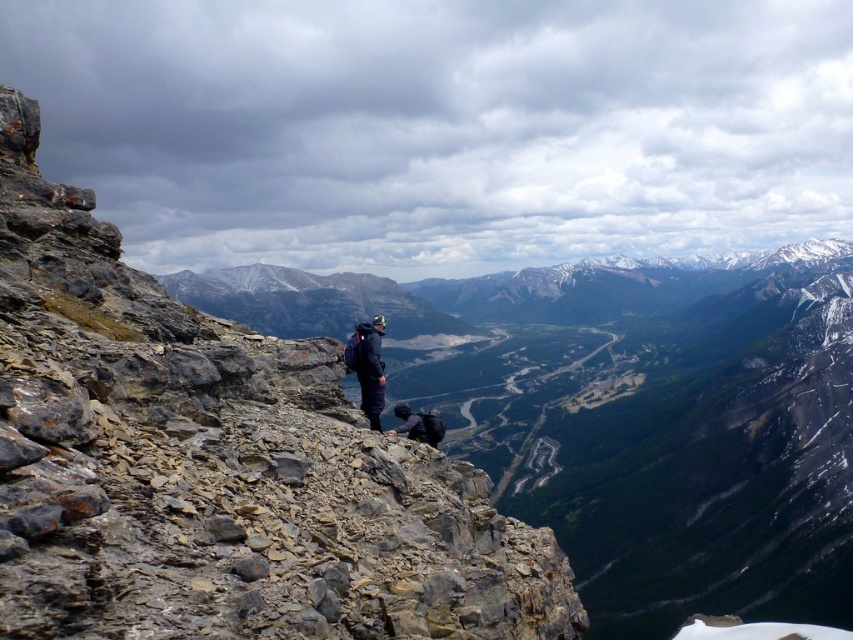
Question: Which point appears farthest from the camera in this image?

Choices:
 (A) (354, 369)
 (B) (405, 419)

Answer: (B)

Question: Among these objects, which one is farthest from the camera?

Choices:
 (A) dark blue fabric backpack at center
 (B) dark blue fabric jacket at center

Answer: (A)

Question: Which point is closer to the camera taking this photo?

Choices:
 (A) (437, 438)
 (B) (355, 330)

Answer: (A)

Question: Is dark blue fabric jacket at center behind dark blue fabric backpack at center?

Choices:
 (A) no
 (B) yes

Answer: (A)

Question: Does dark blue fabric jacket at center appear over dark blue fabric backpack at center?

Choices:
 (A) no
 (B) yes

Answer: (B)

Question: Is the position of dark blue fabric jacket at center more distant than that of dark blue fabric backpack at center?

Choices:
 (A) no
 (B) yes

Answer: (A)